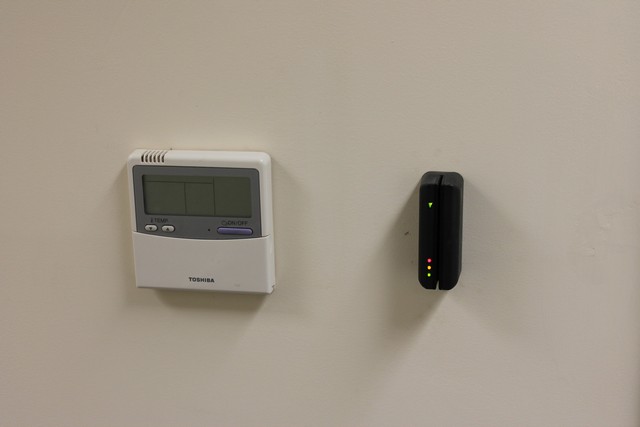
At what (x,y) coordinates should I click in order to perform the action: click on temperature up and down buttons. Please return your answer as a coordinate pair (x, y). Image resolution: width=640 pixels, height=427 pixels. Looking at the image, I should click on (148, 228), (166, 230).